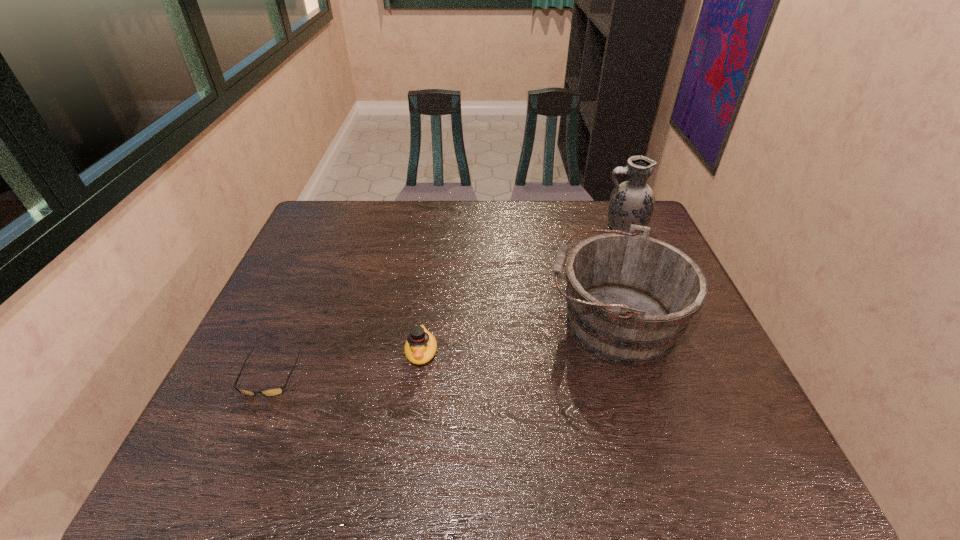
Where is `vacant space at the left edge of the desktop`? vacant space at the left edge of the desktop is located at coordinates (227, 428).

In the image, there is a desktop. Where is `free space at the right edge`? The height and width of the screenshot is (540, 960). free space at the right edge is located at coordinates point(708,348).

I want to click on free space at the far left corner of the desktop, so click(x=325, y=233).

Locate an element on the screen. The height and width of the screenshot is (540, 960). unoccupied position between the tallest object and the second shortest object is located at coordinates (522, 289).

The width and height of the screenshot is (960, 540). Identify the location of blank region between the third object from right to left and the leftmost object. point(346,363).

Where is `vacant space in between the second shortest object and the shortest object`? The height and width of the screenshot is (540, 960). vacant space in between the second shortest object and the shortest object is located at coordinates (346, 363).

Identify the location of empty location between the vase and the shortest object. (447, 301).

Identify the location of vacant region between the shortest object and the wine bucket. (442, 349).

Identify the location of free space between the second object from left to right and the tallest object. (522, 289).

What are the coordinates of `vacant region between the third object from right to left and the third shortest object` in the screenshot? It's located at (517, 337).